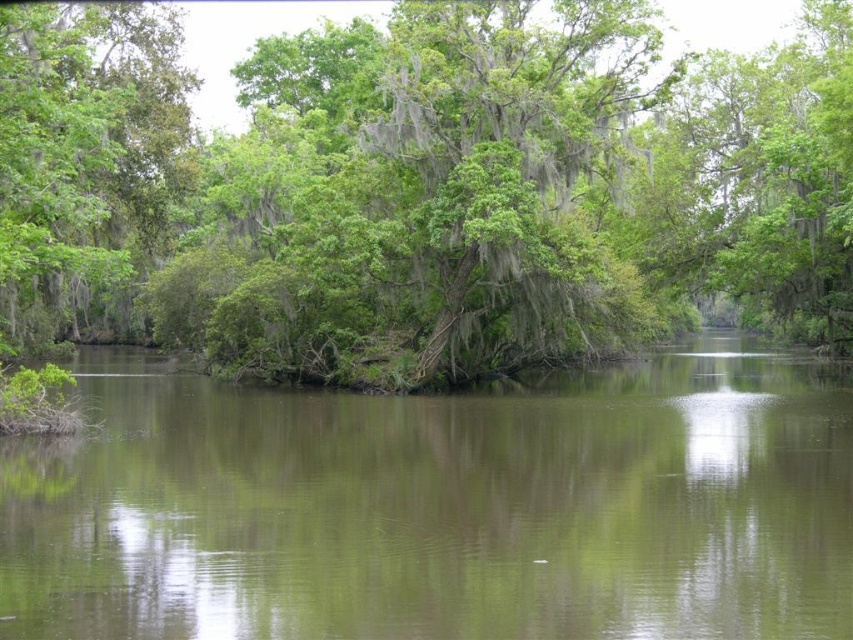
Is green leafy tree at center below green reflective water at center?

No.

Identify the location of green leafy tree at center. The height and width of the screenshot is (640, 853). (422, 188).